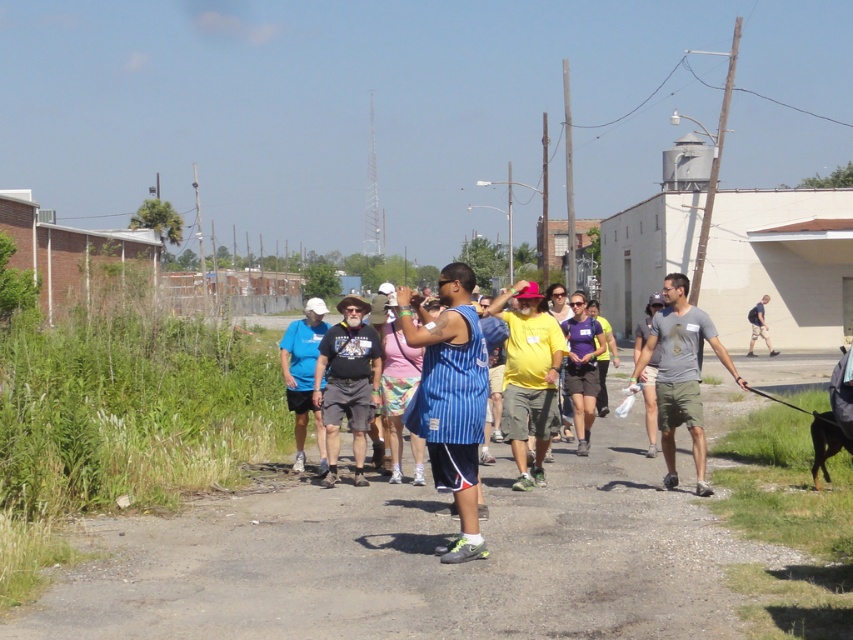
Question: Considering the real-world distances, which object is farthest from the blue striped jersey at center?

Choices:
 (A) gray fabric backpack at center-right
 (B) dark blue striped tank top at center
 (C) black fur dog at lower right
 (D) purple fabric shirt at center

Answer: (A)

Question: Which of the following is the farthest from the observer?

Choices:
 (A) (463, 480)
 (B) (303, 332)
 (C) (531, 360)

Answer: (B)

Question: Can you confirm if dirt road at center is smaller than gray cotton t-shirt at center?

Choices:
 (A) yes
 (B) no

Answer: (B)

Question: Is gray cotton t-shirt at center closer to the viewer compared to gray fabric backpack at center-right?

Choices:
 (A) yes
 (B) no

Answer: (A)

Question: Based on their relative distances, which object is farther from the gray cotton t-shirt at center?

Choices:
 (A) yellow cotton shirt at center
 (B) dark blue striped tank top at center
 (C) gray fabric backpack at center-right
 (D) purple fabric shirt at center

Answer: (C)

Question: Does dark blue striped tank top at center appear on the right side of matte blue shirt at center?

Choices:
 (A) yes
 (B) no

Answer: (A)